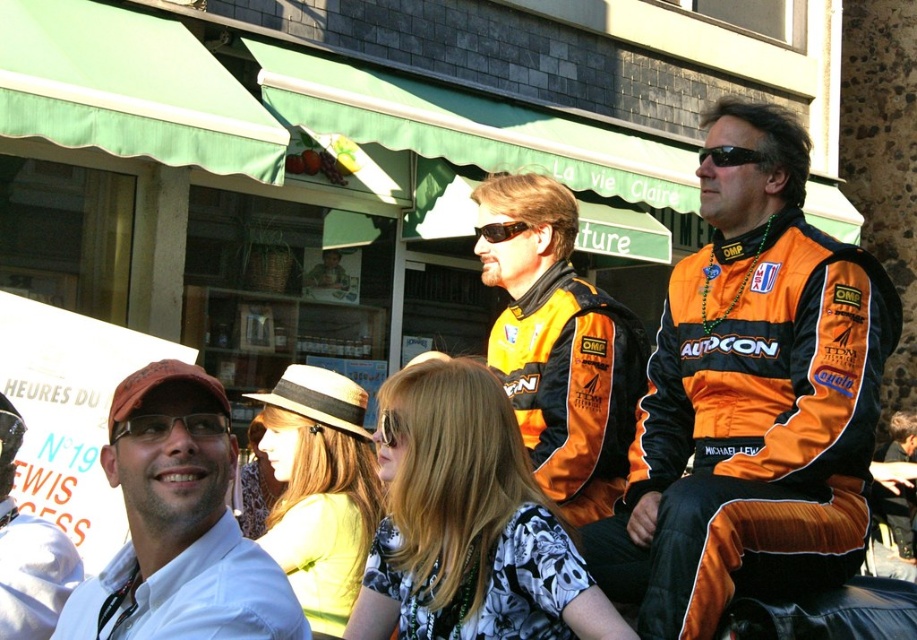
Question: Considering the relative positions of orange synthetic racing suit at right and black plastic sunglasses at upper center in the image provided, where is orange synthetic racing suit at right located with respect to black plastic sunglasses at upper center?

Choices:
 (A) above
 (B) below

Answer: (B)

Question: Can you confirm if orange fabric racing suit at center is wider than black plastic sunglasses at upper center?

Choices:
 (A) no
 (B) yes

Answer: (B)

Question: Which point appears farthest from the camera in this image?

Choices:
 (A) (721, 145)
 (B) (190, 588)
 (C) (717, 108)
 (D) (511, 202)

Answer: (D)

Question: Estimate the real-world distances between objects in this image. Which object is closer to the orange synthetic racing suit at right?

Choices:
 (A) matte white shirt at lower left
 (B) brown textured sunglasses at center
 (C) black plastic sunglasses at upper center
 (D) matte white shirt at center

Answer: (C)

Question: Does matte white shirt at lower left appear under brown textured sunglasses at center?

Choices:
 (A) no
 (B) yes

Answer: (B)

Question: Which of the following is the farthest from the observer?

Choices:
 (A) matte white shirt at lower left
 (B) orange synthetic racing suit at right

Answer: (B)